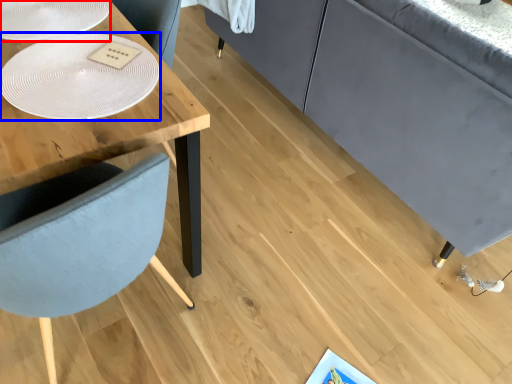
Question: Which of the following is the farthest to the observer, glass plate (highlighted by a red box) or glass plate (highlighted by a blue box)?

Choices:
 (A) glass plate
 (B) glass plate

Answer: (A)